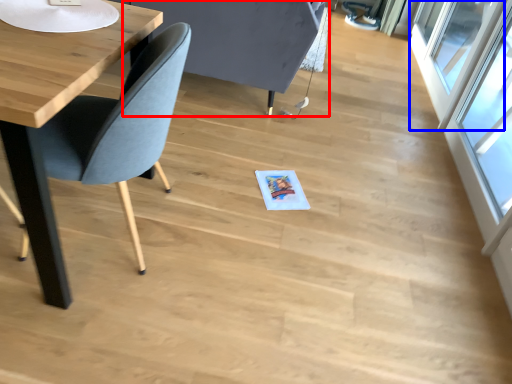
Question: Which object is further to the camera taking this photo, swivel chair (highlighted by a red box) or window (highlighted by a blue box)?

Choices:
 (A) swivel chair
 (B) window

Answer: (B)